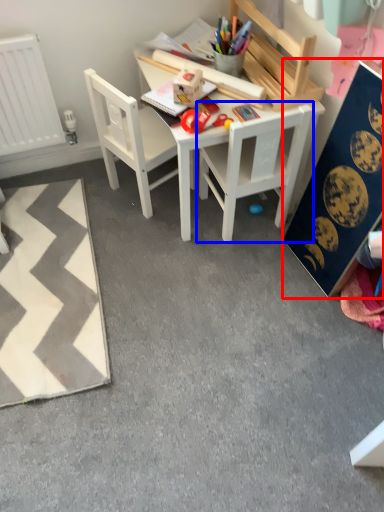
Question: Which point is closer to the camera, bulletin board (highlighted by a red box) or chair (highlighted by a blue box)?

Choices:
 (A) bulletin board
 (B) chair

Answer: (A)